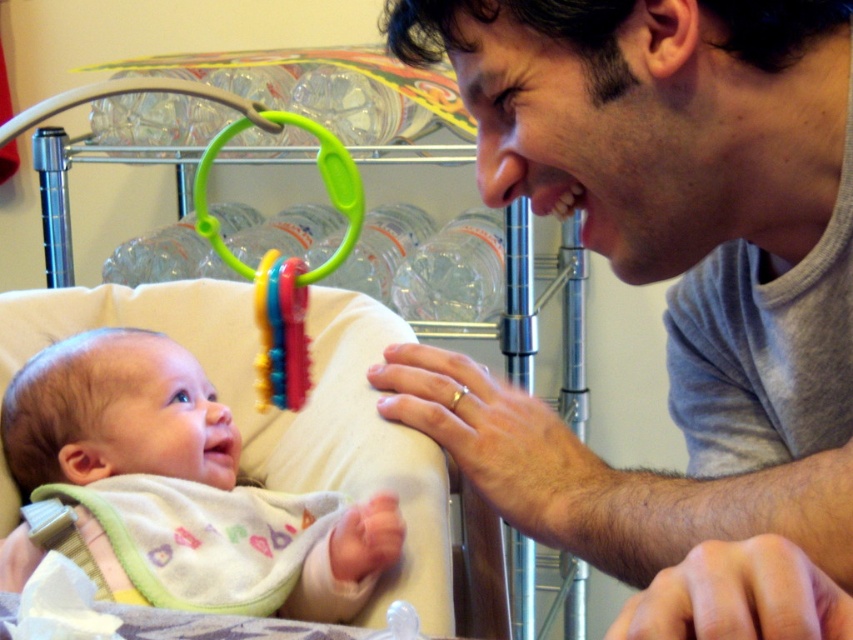
Can you confirm if soft white bib at center is positioned to the left of rubberized plastic teething ring at upper center?

Correct, you'll find soft white bib at center to the left of rubberized plastic teething ring at upper center.

Is soft white bib at center closer to the viewer compared to rubberized plastic teething ring at upper center?

No.

This screenshot has height=640, width=853. Describe the element at coordinates (181, 486) in the screenshot. I see `soft white bib at center` at that location.

Find the location of a particular element. soft white bib at center is located at coordinates pos(181,486).

Can you confirm if gray cotton shirt at upper right is positioned to the right of rubberized plastic teething ring at upper center?

Correct, you'll find gray cotton shirt at upper right to the right of rubberized plastic teething ring at upper center.

Can you confirm if gray cotton shirt at upper right is taller than rubberized plastic teething ring at upper center?

Yes.

The height and width of the screenshot is (640, 853). What do you see at coordinates (665, 260) in the screenshot?
I see `gray cotton shirt at upper right` at bounding box center [665, 260].

Where is `gray cotton shirt at upper right`? gray cotton shirt at upper right is located at coordinates (x=665, y=260).

Who is positioned more to the right, gray cotton shirt at upper right or soft white bib at center?

From the viewer's perspective, gray cotton shirt at upper right appears more on the right side.

Is gray cotton shirt at upper right below soft white bib at center?

No.

Between point (708, 157) and point (115, 388), which one is positioned behind?

Positioned behind is point (115, 388).

In order to click on gray cotton shirt at upper right in this screenshot , I will do `click(665, 260)`.